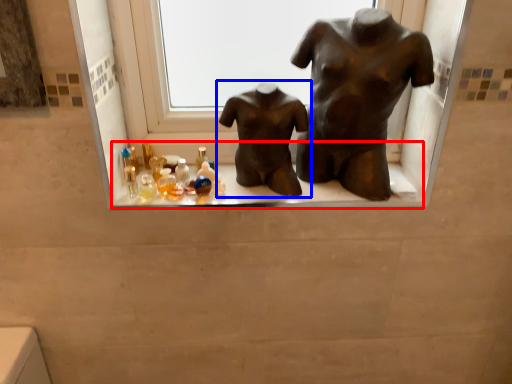
Question: Which object appears farthest to the camera in this image, window sill (highlighted by a red box) or statue (sculpture) (highlighted by a blue box)?

Choices:
 (A) window sill
 (B) statue (sculpture)

Answer: (A)